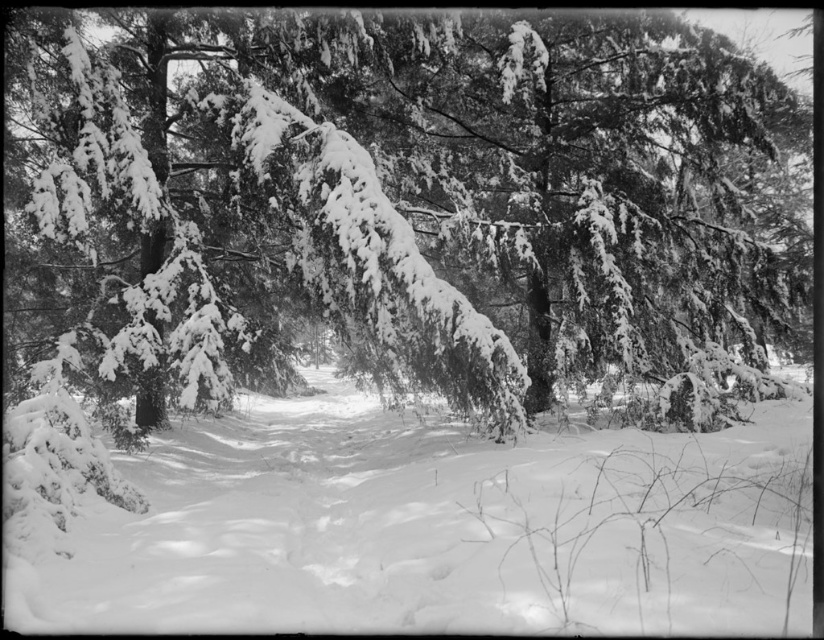
You are standing at the edge of the forest in the winter scene. You notice a specific point located at coordinates point [396,195]. Based on the description, can you determine what object this point is located on?

The point [396,195] is on the snow covered evergreen at center.